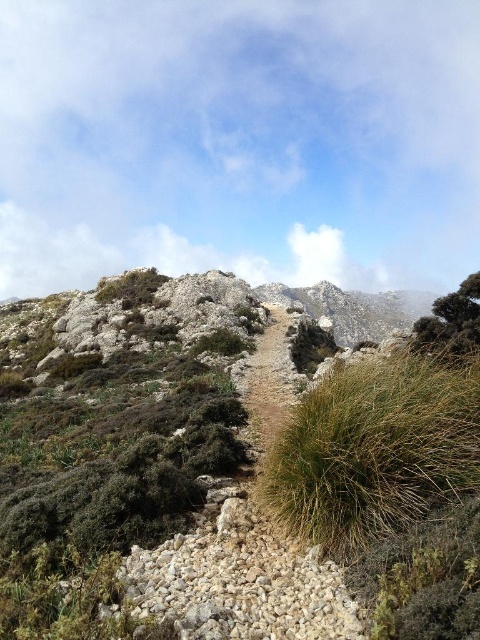
Does point (374, 460) lie behind point (417, 342)?

No.

Is green fibrous grass at center to the left of green leafy bush at upper right from the viewer's perspective?

Yes, green fibrous grass at center is to the left of green leafy bush at upper right.

Locate an element on the screen. The width and height of the screenshot is (480, 640). green fibrous grass at center is located at coordinates click(x=375, y=449).

In order to click on green fibrous grass at center in this screenshot , I will do `click(375, 449)`.